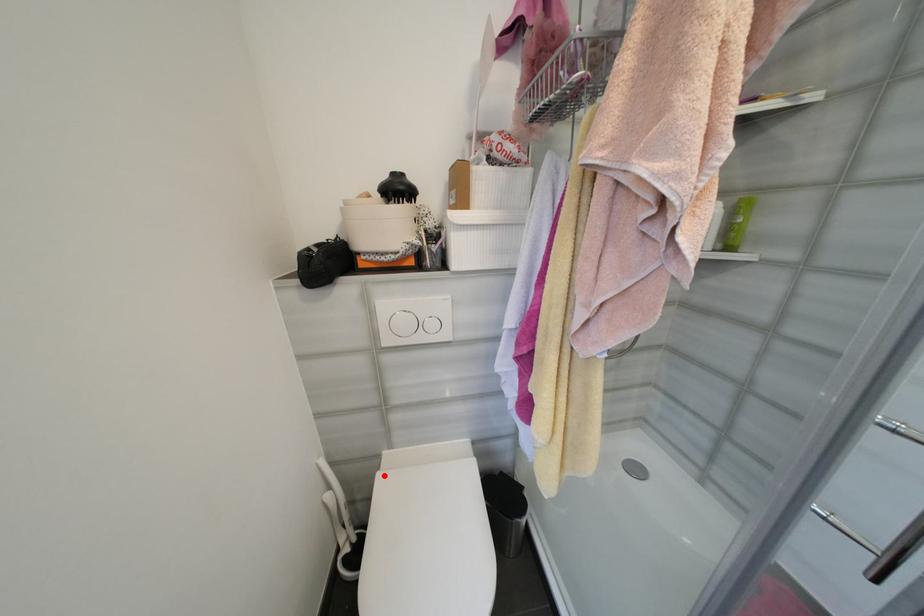
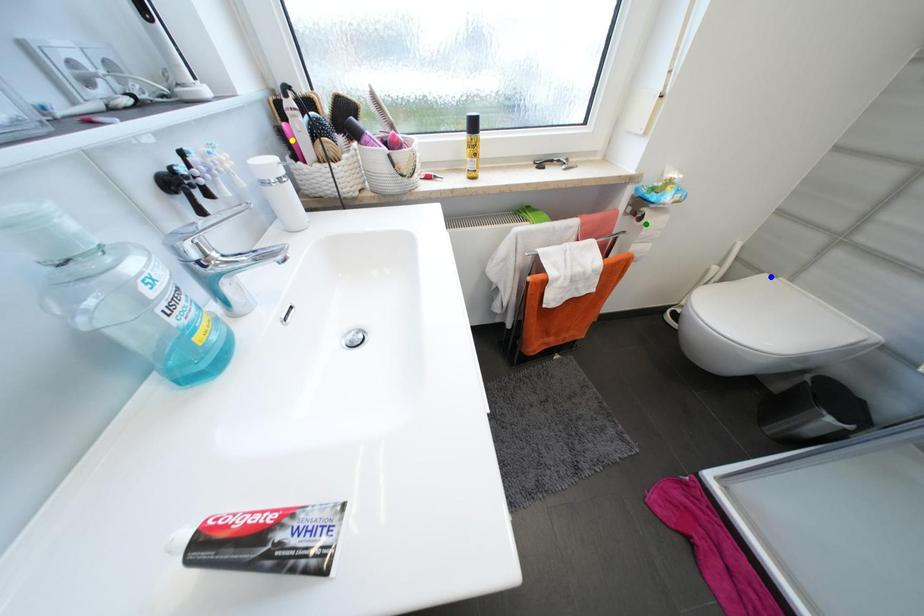
Question: I am providing you with two images of the same scene from different viewpoints. A red point is marked on the first image. You are given multiple points on the second image. Which mark in image 2 goes with the point in image 1?

Choices:
 (A) green point
 (B) yellow point
 (C) blue point

Answer: (C)